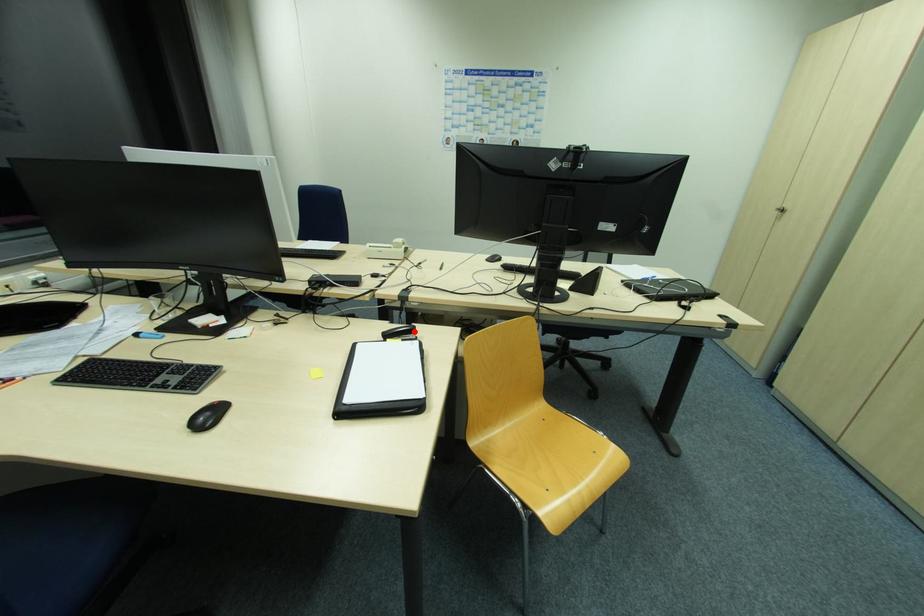
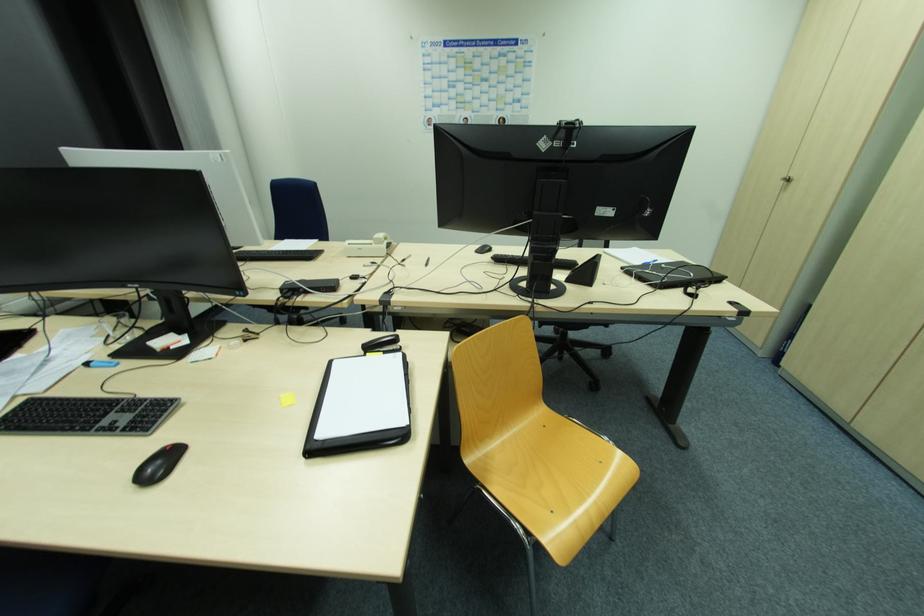
Where in the second image is the point corresponding to the highlighted location from the first image?

(397, 341)